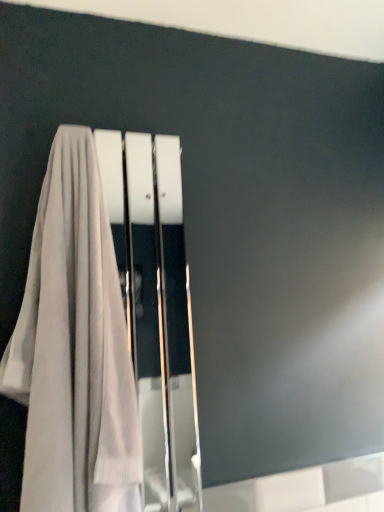
Question: In the image, is white glossy screen door at center positioned in front of or behind light beige fabric towel at left?

Choices:
 (A) front
 (B) behind

Answer: (B)

Question: In the image, is white glossy screen door at center on the left side or the right side of light beige fabric towel at left?

Choices:
 (A) right
 (B) left

Answer: (A)

Question: Do you think white glossy screen door at center is within light beige fabric towel at left, or outside of it?

Choices:
 (A) outside
 (B) inside

Answer: (B)

Question: Is point (48, 403) positioned closer to the camera than point (102, 183)?

Choices:
 (A) closer
 (B) farther

Answer: (A)

Question: From a real-world perspective, relative to white glossy screen door at center, is light beige fabric towel at left vertically above or below?

Choices:
 (A) above
 (B) below

Answer: (A)

Question: Based on their sizes in the image, would you say light beige fabric towel at left is bigger or smaller than white glossy screen door at center?

Choices:
 (A) small
 (B) big

Answer: (B)

Question: Looking at their shapes, would you say light beige fabric towel at left is wider or thinner than white glossy screen door at center?

Choices:
 (A) thin
 (B) wide

Answer: (B)